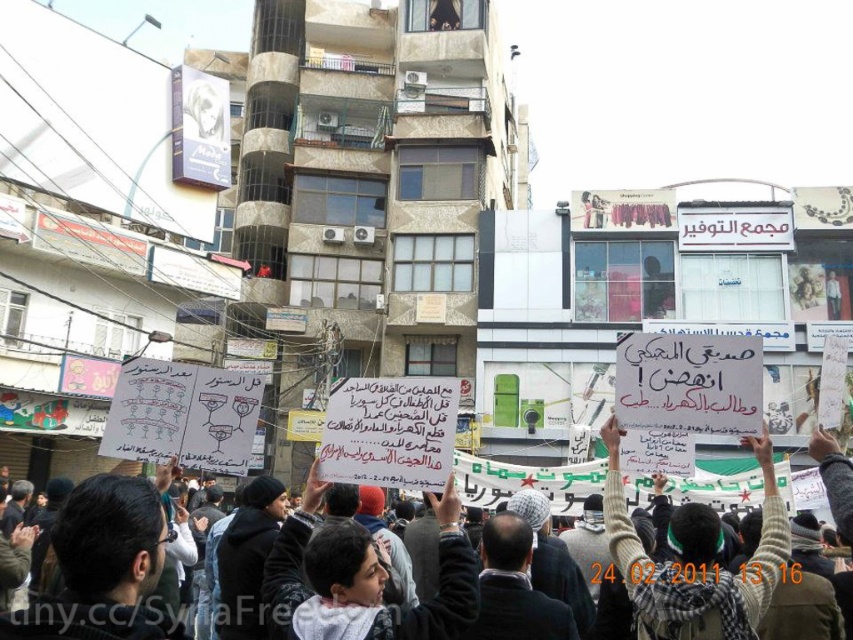
You are a photographer trying to capture a clear shot of the white paper sign at center and the white knitted sweater at center. Based on their positions, which object should you focus on first to ensure both are in frame?

The white paper sign at center is located below the white knitted sweater at center. To ensure both are in frame, focus on the white knitted sweater at center first, then adjust to include the sign below it.

You are a photographer standing in the crowd at the protest. You want to take a clear photo of the white paper sign at center. Considering your camera can focus on objects up to 20 meters away, will you be able to capture a sharp image of the sign?

The white paper sign at center is 19.69 meters away from the viewer. Since the camera can focus up to 20 meters, it is within range, so yes, you can capture a sharp image of the white paper sign at center.

You are a journalist taking photos of the protest. You notice the white paper sign at center and the white knitted sweater at center. Which object is positioned to the left from your perspective?

The white paper sign at center is to the left of the white knitted sweater at center, so the white paper sign at center is positioned to the left.